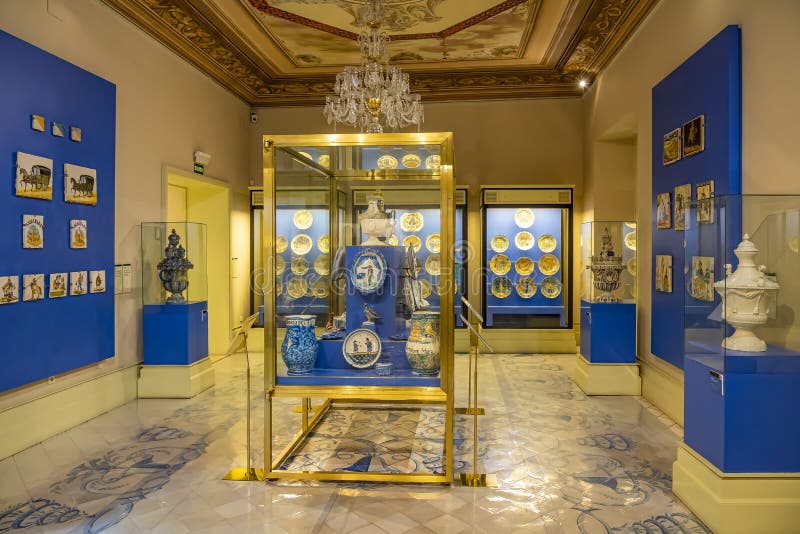
Find the location of a particular element. floor is located at coordinates (525, 424).